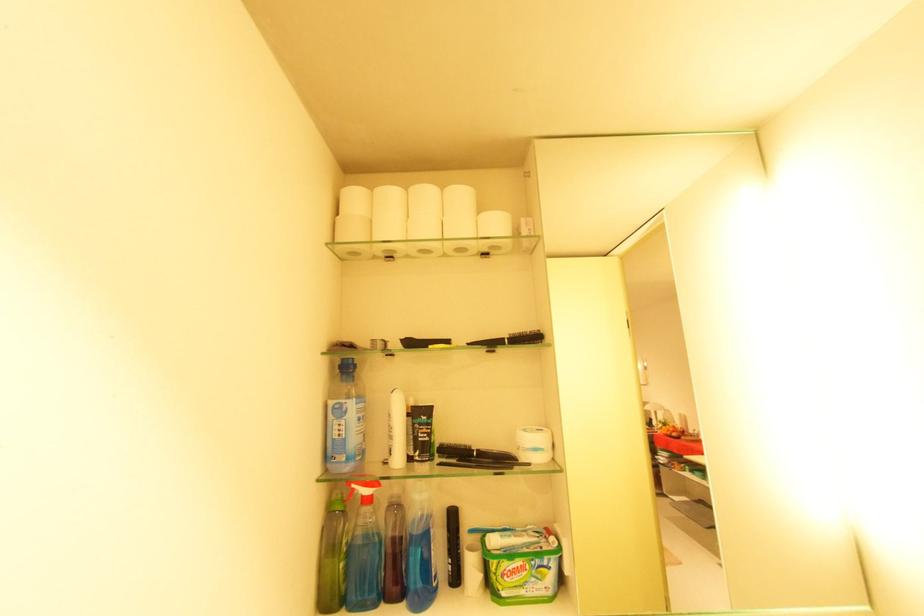
The image size is (924, 616). In order to click on white pump dispenser in this screenshot , I will do `click(396, 430)`.